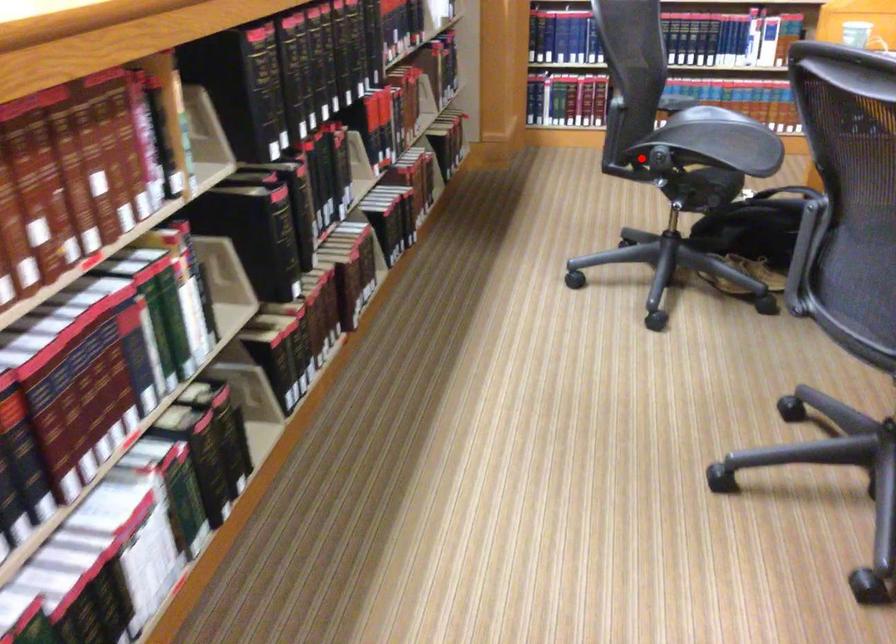
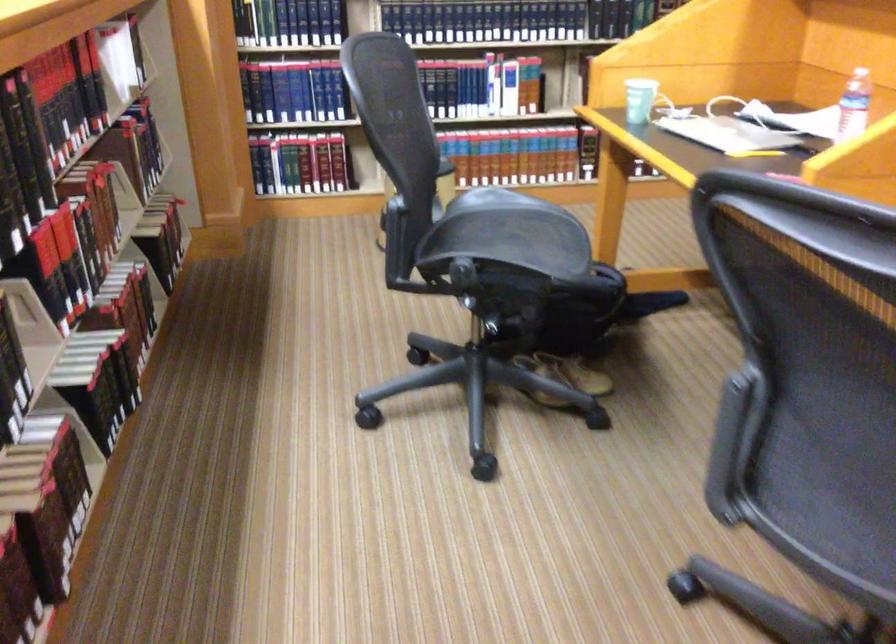
Question: A red point is marked in image1. In image2, is the corresponding 3D point closer to the camera or farther? Reply with the corresponding letter.

Choices:
 (A) The corresponding 3D point is closer.
 (B) The corresponding 3D point is farther.

Answer: (A)